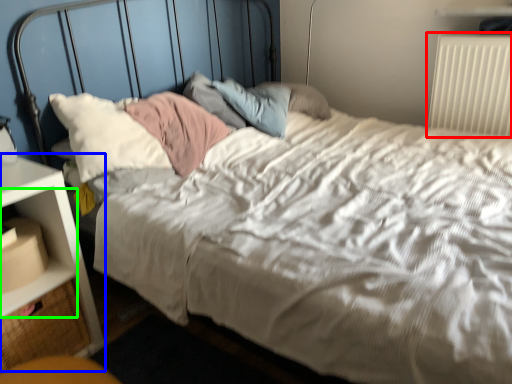
Question: Which object is positioned farthest from radiator (highlighted by a red box)? Select from nightstand (highlighted by a blue box) and shelf (highlighted by a green box).

Choices:
 (A) nightstand
 (B) shelf

Answer: (B)